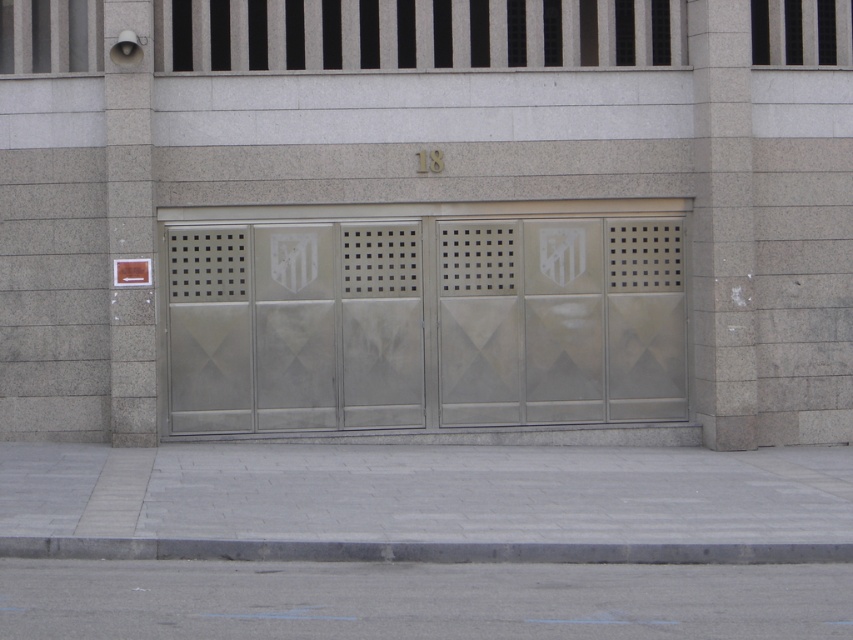
You are standing in front of the building facade and notice a point marked at coordinates (424,323). What material is this point located on?

The point at (424,323) is located on satin silver metal at center.

You are a delivery driver approaching the building and need to park on the gray concrete pavement at lower center. However, there is a gray concrete curb at lower center in your path. Which direction should you move to avoid the curb and reach the pavement?

The gray concrete pavement at lower center is to the right of the gray concrete curb at lower center, so you should move to the right to avoid the curb and reach the pavement.

You are standing in front of the building facade and notice a specific point at coordinates (424, 323). What material can be found at that exact location?

The material at point (424, 323) is satin silver metal.